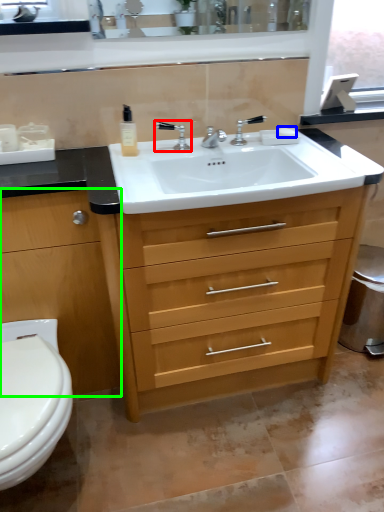
Question: Which object is the closest to the tap (highlighted by a red box)? Choose among these: soap (highlighted by a blue box) or chest of drawers (highlighted by a green box).

Choices:
 (A) soap
 (B) chest of drawers

Answer: (A)